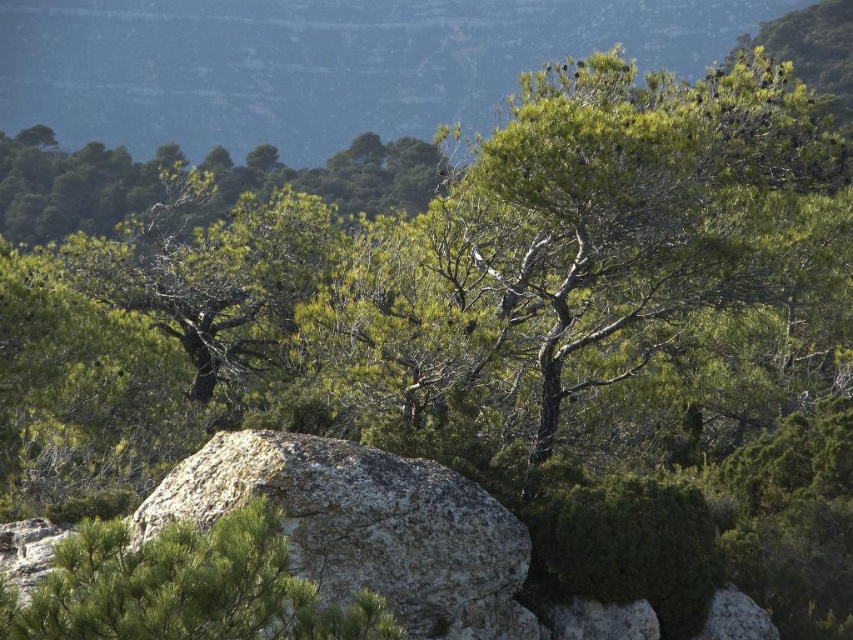
Question: Which object is farther from the camera taking this photo?

Choices:
 (A) green leafy tree at left
 (B) green leafy tree at center

Answer: (A)

Question: Is rough textured rock at center to the left of green leafy tree at center from the viewer's perspective?

Choices:
 (A) yes
 (B) no

Answer: (B)

Question: Which object is the farthest from the rough textured rock at center?

Choices:
 (A) green leafy tree at left
 (B) green leafy tree at center

Answer: (A)

Question: Does rough textured rock at center have a larger size compared to green leafy tree at center?

Choices:
 (A) no
 (B) yes

Answer: (B)

Question: Estimate the real-world distances between objects in this image. Which object is closer to the green leafy tree at center?

Choices:
 (A) green leafy tree at left
 (B) rough textured rock at center

Answer: (B)

Question: Does green leafy tree at center come behind green leafy tree at left?

Choices:
 (A) no
 (B) yes

Answer: (A)